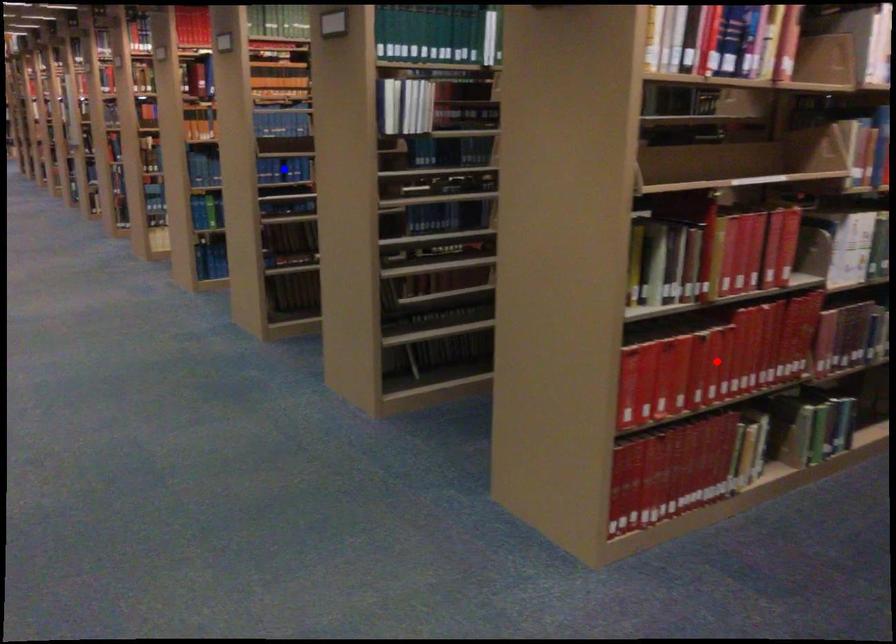
Question: Two points are marked on the image. Which point is closer to the camera?

Choices:
 (A) Blue point is closer.
 (B) Red point is closer.

Answer: (B)